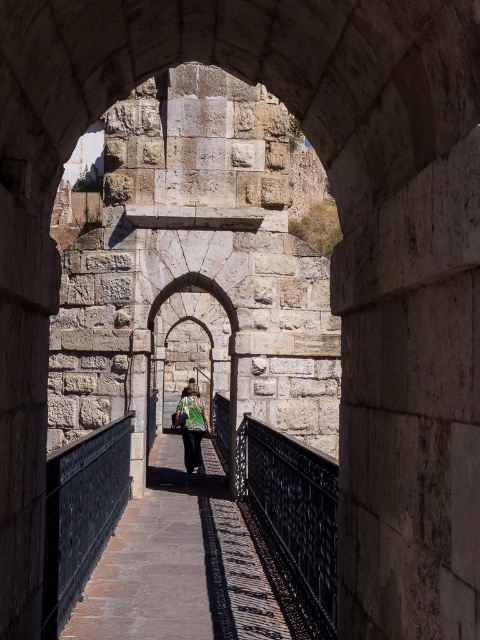
Question: Can you confirm if black wrought iron railing at center is positioned to the left of stone archway at center?

Choices:
 (A) no
 (B) yes

Answer: (A)

Question: Is black wrought iron railing at center bigger than green fabric backpack at center?

Choices:
 (A) yes
 (B) no

Answer: (B)

Question: Which object appears farthest from the camera in this image?

Choices:
 (A) black wrought iron railing at center
 (B) green fabric backpack at center
 (C) stone archway at center
 (D) brown stone path at center

Answer: (B)

Question: Which is nearer to the green fabric backpack at center?

Choices:
 (A) stone archway at center
 (B) brown stone path at center

Answer: (A)

Question: Can you confirm if brown stone path at center is positioned above green fabric backpack at center?

Choices:
 (A) no
 (B) yes

Answer: (A)

Question: Which point is closer to the camera?

Choices:
 (A) stone archway at center
 (B) black wrought iron railing at center

Answer: (B)